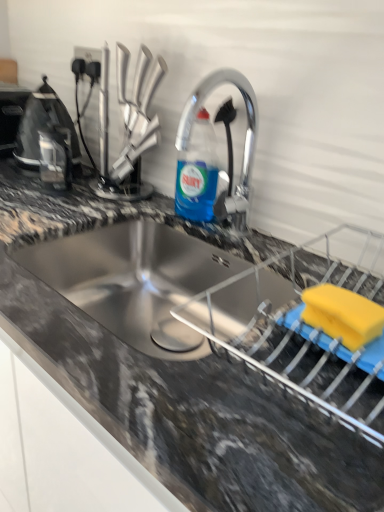
You are a GUI agent. You are given a task and a screenshot of the screen. Output one action in this format:
    pyautogui.click(x=<x>, y=<y>)
    Task: Click on the free space on the front side of metallic silver faucet at upper center
    
    Given the screenshot: What is the action you would take?
    pyautogui.click(x=226, y=228)